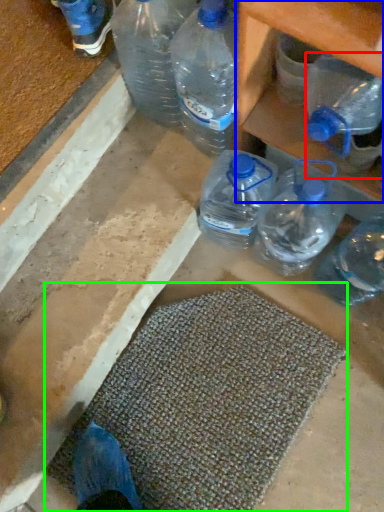
Question: Which is nearer to the bottle (highlighted by a red box)? shelf (highlighted by a blue box) or bath mat (highlighted by a green box).

Choices:
 (A) shelf
 (B) bath mat

Answer: (A)